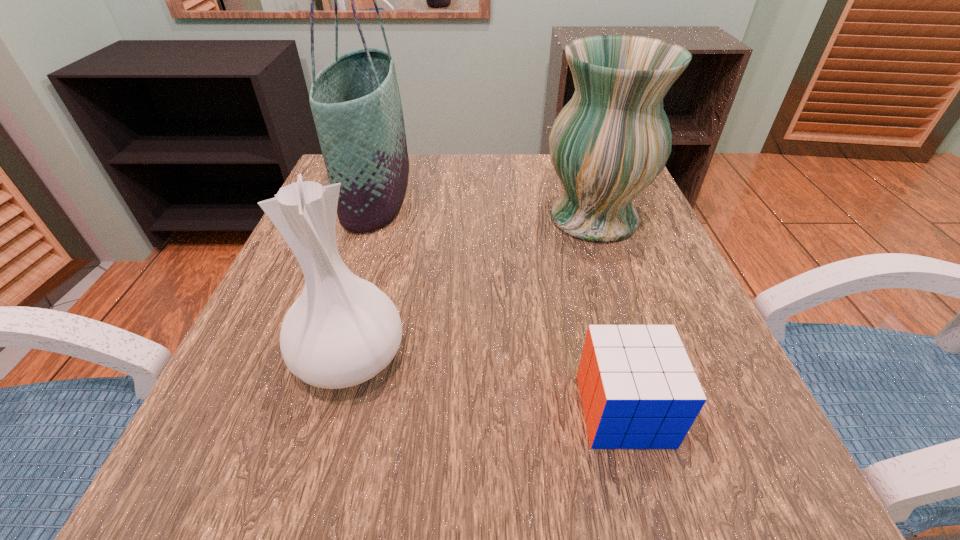
This screenshot has width=960, height=540. In the image, there is a desktop. Find the location of `vacant space at the near edge`. vacant space at the near edge is located at coordinates (558, 456).

Identify the location of vacant space at the left edge of the desktop. (276, 374).

Find the location of `vacant space at the right edge of the desktop`. vacant space at the right edge of the desktop is located at coordinates (656, 279).

At what (x,y) coordinates should I click in order to perform the action: click on vacant space in between the shorter vase and the tote bag. Please return your answer as a coordinate pair (x, y). This screenshot has width=960, height=540. Looking at the image, I should click on (363, 275).

You are a GUI agent. You are given a task and a screenshot of the screen. Output one action in this format:
    pyautogui.click(x=<x>, y=<y>)
    Task: Click on the vacant region between the right vase and the tote bag
    
    Given the screenshot: What is the action you would take?
    pos(485,205)

Where is `free space between the nearer vase and the right vase`? This screenshot has width=960, height=540. free space between the nearer vase and the right vase is located at coordinates (472, 287).

I want to click on free space between the tallest object and the left vase, so click(363, 275).

The image size is (960, 540). I want to click on free space between the farther vase and the cube, so click(x=609, y=314).

Where is `empty space that is in between the tallest object and the left vase`? This screenshot has width=960, height=540. empty space that is in between the tallest object and the left vase is located at coordinates (363, 275).

In order to click on vacant area that lies between the cube and the nearer vase in this screenshot , I will do `click(487, 383)`.